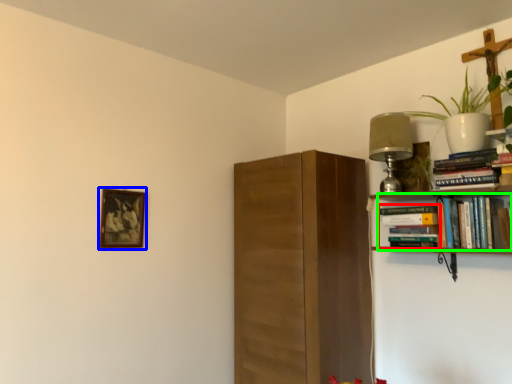
Question: Which object is the closest to the book (highlighted by a red box)? Choose among these: picture frame (highlighted by a blue box) or book (highlighted by a green box).

Choices:
 (A) picture frame
 (B) book

Answer: (B)